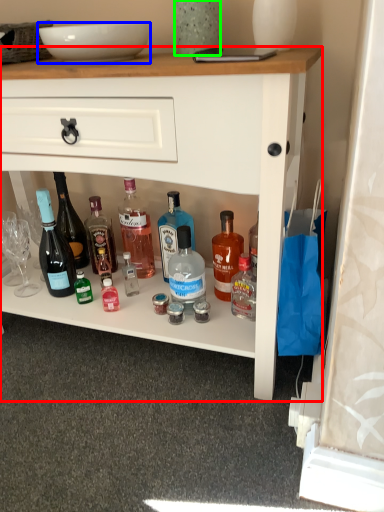
Question: Based on their relative distances, which object is farther from desk (highlighted by a red box)? Choose from bowl (highlighted by a blue box) and glass vase (highlighted by a green box).

Choices:
 (A) bowl
 (B) glass vase

Answer: (B)